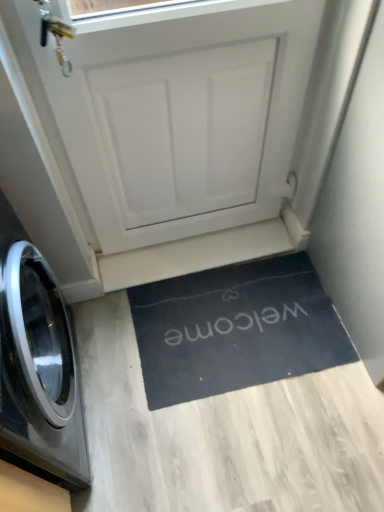
Describe the element at coordinates (39, 369) in the screenshot. I see `black glossy washing machine at left` at that location.

Describe the element at coordinates (235, 329) in the screenshot. I see `black rubber doormat at lower center` at that location.

Measure the distance between white matte door at center and camera.

A distance of 36.90 inches exists between white matte door at center and camera.

You are a GUI agent. You are given a task and a screenshot of the screen. Output one action in this format:
    pyautogui.click(x=<x>, y=<y>)
    Task: Click on the black glossy washing machine at left
    The height and width of the screenshot is (512, 384).
    Given the screenshot: What is the action you would take?
    pyautogui.click(x=39, y=369)

Find the location of a particular element. The image size is (384, 512). doormat lying below the black glossy washing machine at left (from the image's perspective) is located at coordinates (235, 329).

Looking at their sizes, would you say black glossy washing machine at left is wider or thinner than black rubber doormat at lower center?

Considering their sizes, black glossy washing machine at left looks slimmer than black rubber doormat at lower center.

Is black glossy washing machine at left spatially inside black rubber doormat at lower center, or outside of it?

black glossy washing machine at left is spatially situated outside black rubber doormat at lower center.

From the image's perspective, which one is positioned lower, black glossy washing machine at left or black rubber doormat at lower center?

black rubber doormat at lower center appears lower in the image.

From the image's perspective, is black rubber doormat at lower center positioned above or below white matte door at center?

black rubber doormat at lower center is below white matte door at center.

Does black rubber doormat at lower center appear on the left side of white matte door at center?

In fact, black rubber doormat at lower center is to the right of white matte door at center.

Considering their positions, is black rubber doormat at lower center located in front of or behind white matte door at center?

black rubber doormat at lower center is positioned farther from the viewer than white matte door at center.

Does white matte door at center have a larger size compared to black rubber doormat at lower center?

Indeed, white matte door at center has a larger size compared to black rubber doormat at lower center.

Between white matte door at center and black rubber doormat at lower center, which one is positioned behind?

black rubber doormat at lower center is further from the camera.

Consider the image. Which object is thinner, white matte door at center or black rubber doormat at lower center?

white matte door at center is thinner.

Considering the sizes of white matte door at center and black rubber doormat at lower center in the image, is white matte door at center taller or shorter than black rubber doormat at lower center?

In the image, white matte door at center appears to be taller than black rubber doormat at lower center.

Is black rubber doormat at lower center not within black glossy washing machine at left?

That's correct, black rubber doormat at lower center is outside of black glossy washing machine at left.

Is black rubber doormat at lower center oriented towards black glossy washing machine at left?

No, black rubber doormat at lower center is not aimed at black glossy washing machine at left.

Between black rubber doormat at lower center and black glossy washing machine at left, which one is positioned in front?

black glossy washing machine at left is more forward.

Does black glossy washing machine at left appear on the left side of white matte door at center?

Yes, black glossy washing machine at left is to the left of white matte door at center.

Would you say black glossy washing machine at left is inside or outside white matte door at center?

The correct answer is: outside.

Is point (3, 355) farther from camera compared to point (291, 28)?

No, it is in front of (291, 28).

Does black glossy washing machine at left have a lesser width compared to white matte door at center?

No, black glossy washing machine at left is not thinner than white matte door at center.

Between white matte door at center and black glossy washing machine at left, which one has smaller size?

white matte door at center is smaller.

Is white matte door at center closer to the viewer compared to black glossy washing machine at left?

No, white matte door at center is further to the viewer.

From the picture: Is white matte door at center facing towards black glossy washing machine at left?

No.

You are a GUI agent. You are given a task and a screenshot of the screen. Output one action in this format:
    pyautogui.click(x=<x>, y=<y>)
    Task: Click on the doormat on the right side of black glossy washing machine at left
    
    Given the screenshot: What is the action you would take?
    pyautogui.click(x=235, y=329)

The width and height of the screenshot is (384, 512). Find the location of `screen door that is on the left side of black rubber doormat at lower center`. screen door that is on the left side of black rubber doormat at lower center is located at coordinates (175, 112).

Which object lies further to the anchor point white matte door at center, black glossy washing machine at left or black rubber doormat at lower center?

black glossy washing machine at left lies further to white matte door at center than the other object.

Looking at the image, which one is located further to black glossy washing machine at left, black rubber doormat at lower center or white matte door at center?

Based on the image, white matte door at center appears to be further to black glossy washing machine at left.

Which object lies further to the anchor point black glossy washing machine at left, white matte door at center or black rubber doormat at lower center?

The object further to black glossy washing machine at left is white matte door at center.

Considering their positions, is white matte door at center positioned closer to black rubber doormat at lower center than black glossy washing machine at left?

black glossy washing machine at left is closer to black rubber doormat at lower center.

From the image, which object appears to be nearer to black rubber doormat at lower center, black glossy washing machine at left or white matte door at center?

black glossy washing machine at left.

When comparing their distances from white matte door at center, does black rubber doormat at lower center or black glossy washing machine at left seem closer?

black rubber doormat at lower center is closer to white matte door at center.

The width and height of the screenshot is (384, 512). I want to click on screen door between black glossy washing machine at left and black rubber doormat at lower center in the front-back direction, so click(175, 112).